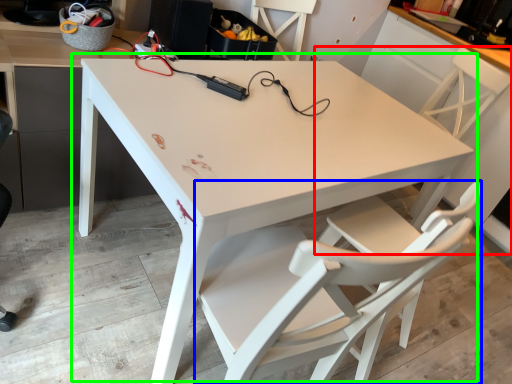
Question: Which object is positioned farthest from chair (highlighted by a red box)? Select from chair (highlighted by a blue box) and table (highlighted by a green box).

Choices:
 (A) chair
 (B) table

Answer: (A)